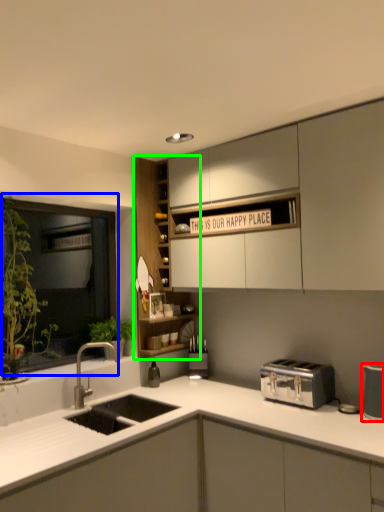
Question: Which object is positioned farthest from appliance (highlighted by a red box)? Select from window (highlighted by a blue box) and cabinetry (highlighted by a green box).

Choices:
 (A) window
 (B) cabinetry

Answer: (A)